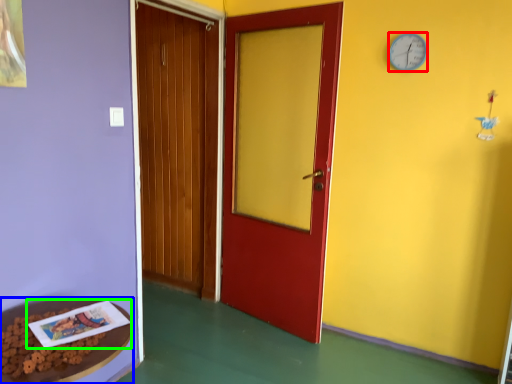
Question: Considering the real-world distances, which object is farthest from clock (highlighted by a red box)? table (highlighted by a blue box) or book (highlighted by a green box)?

Choices:
 (A) table
 (B) book

Answer: (A)